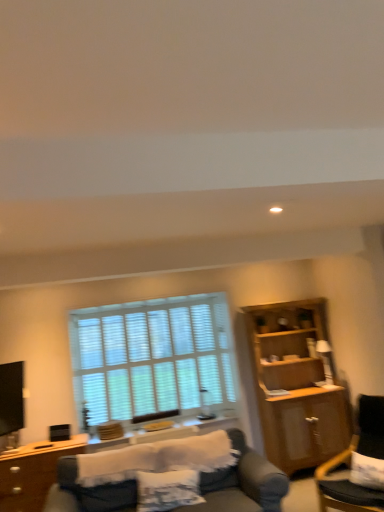
Question: Is dark gray fabric chair at lower right beside wooden side table at lower center?

Choices:
 (A) no
 (B) yes

Answer: (A)

Question: Is dark gray fabric chair at lower right positioned beyond the bounds of wooden side table at lower center?

Choices:
 (A) no
 (B) yes

Answer: (B)

Question: Can you confirm if dark gray fabric chair at lower right is shorter than wooden side table at lower center?

Choices:
 (A) yes
 (B) no

Answer: (B)

Question: Is dark gray fabric chair at lower right facing towards wooden side table at lower center?

Choices:
 (A) no
 (B) yes

Answer: (A)

Question: Considering the relative sizes of dark gray fabric chair at lower right and wooden side table at lower center in the image provided, is dark gray fabric chair at lower right taller than wooden side table at lower center?

Choices:
 (A) no
 (B) yes

Answer: (B)

Question: From the image's perspective, is wooden side table at lower center above or below white wood blinds at center?

Choices:
 (A) above
 (B) below

Answer: (B)

Question: Looking at their shapes, would you say wooden side table at lower center is wider or thinner than white wood blinds at center?

Choices:
 (A) wide
 (B) thin

Answer: (A)

Question: In the image, is wooden side table at lower center positioned in front of or behind white wood blinds at center?

Choices:
 (A) behind
 (B) front

Answer: (B)

Question: Do you think wooden side table at lower center is within white wood blinds at center, or outside of it?

Choices:
 (A) inside
 (B) outside

Answer: (B)

Question: Visually, is brown wood desk at lower left positioned to the left or to the right of wooden cabinet at right?

Choices:
 (A) left
 (B) right

Answer: (A)

Question: Considering the positions of brown wood desk at lower left and wooden cabinet at right in the image, is brown wood desk at lower left taller or shorter than wooden cabinet at right?

Choices:
 (A) short
 (B) tall

Answer: (A)

Question: In the image, is brown wood desk at lower left positioned in front of or behind wooden cabinet at right?

Choices:
 (A) front
 (B) behind

Answer: (A)

Question: Is point (44, 446) positioned closer to the camera than point (316, 426)?

Choices:
 (A) farther
 (B) closer

Answer: (B)

Question: Based on their sizes in the image, would you say brown wood desk at lower left is bigger or smaller than white wood blinds at center?

Choices:
 (A) small
 (B) big

Answer: (B)

Question: Would you say brown wood desk at lower left is to the left or to the right of white wood blinds at center in the picture?

Choices:
 (A) left
 (B) right

Answer: (A)